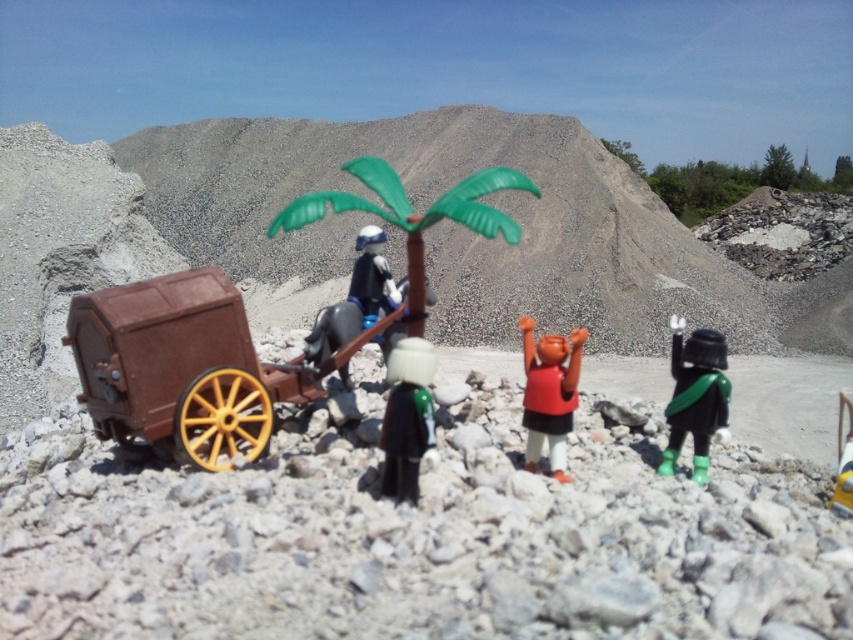
Question: Which object is farther from the camera taking this photo?

Choices:
 (A) green plastic palm tree at center
 (B) shiny silver helmet at center
 (C) matte red tank top at center
 (D) yellow plastic toy at lower right

Answer: (C)

Question: Is shiny black helmet at center right wider than glossy plastic figure at center?

Choices:
 (A) yes
 (B) no

Answer: (B)

Question: Can you confirm if matte red tank top at center is positioned to the right of glossy plastic figure at center?

Choices:
 (A) yes
 (B) no

Answer: (A)

Question: Which of these objects is positioned closest to the glossy plastic figure at center?

Choices:
 (A) brown matte wagon at left
 (B) matte red tank top at center
 (C) yellow plastic toy at lower right

Answer: (A)

Question: Is green plastic palm tree at center closer to camera compared to shiny silver helmet at center?

Choices:
 (A) yes
 (B) no

Answer: (B)

Question: Based on their relative distances, which object is farther from the glossy plastic figure at center?

Choices:
 (A) yellow plastic toy at lower right
 (B) shiny black helmet at center right

Answer: (A)